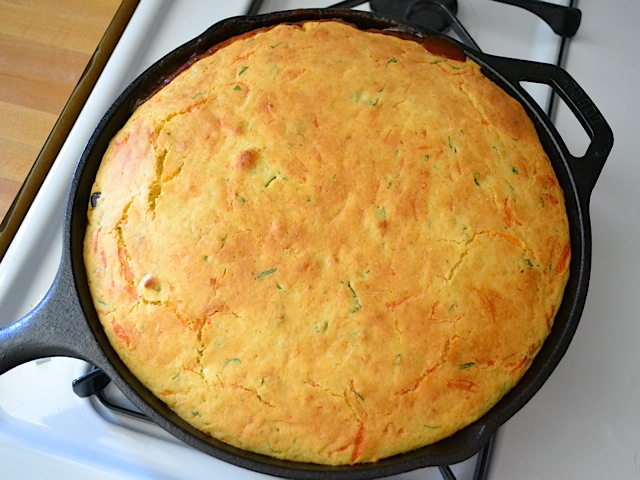
At what (x,y) coordinates should I click in order to perform the action: click on wood floor underneath. Please return your answer as a coordinate pair (x, y). Looking at the image, I should click on (35, 47).